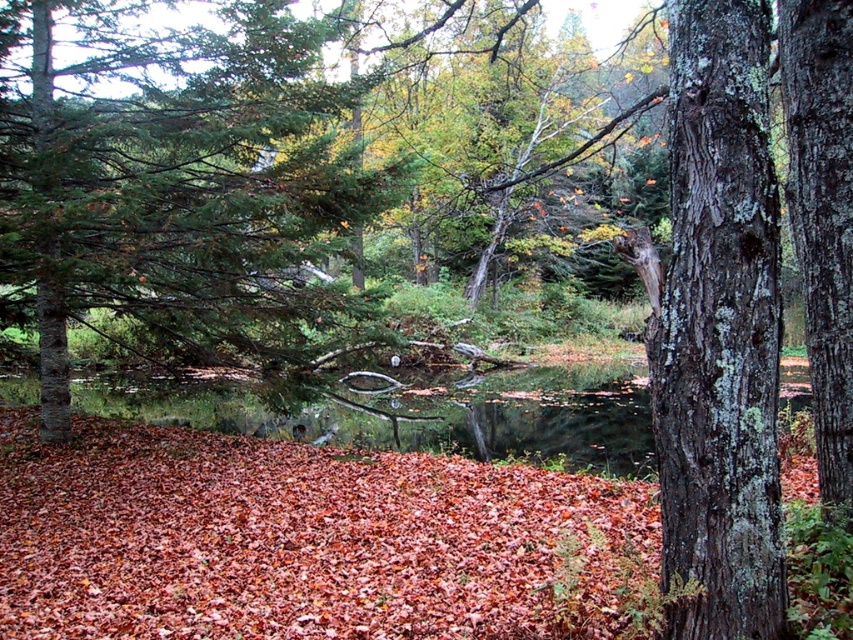
You are standing in the autumnal forest scene. You see two points marked in the image. Which point is closer to you, point (473, 634) or point (733, 243)?

Point (733, 243) is closer to you because it is less further to the camera than point (473, 634).

You are standing in the autumnal forest scene described. You see a grayish brown bark tree trunk at right. If you were to walk directly towards the point at coordinates (718, 330), would you be moving towards the grayish brown bark tree trunk at right?

Yes, because the point (718, 330) corresponds to the grayish brown bark tree trunk at right, so walking towards that coordinate would lead you directly to it.